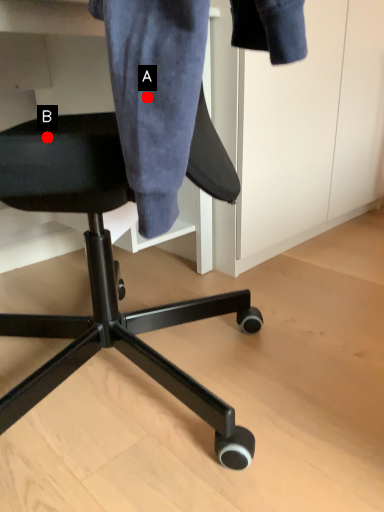
Question: Two points are circled on the image, labeled by A and B beside each circle. Which point is further to the camera?

Choices:
 (A) A is further
 (B) B is further

Answer: (B)